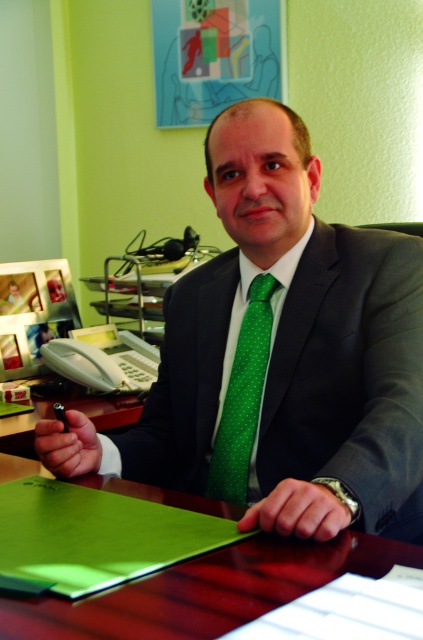
Which of these two, green dotted tie at center or green plastic pen at lower left, stands taller?

green dotted tie at center is taller.

Who is positioned more to the right, green dotted tie at center or green plastic pen at lower left?

green dotted tie at center

Identify the location of green dotted tie at center. (242, 396).

Is matte black suit at center taller than wooden table at center?

Indeed, matte black suit at center has a greater height compared to wooden table at center.

Who is positioned more to the left, matte black suit at center or wooden table at center?

From the viewer's perspective, wooden table at center appears more on the left side.

Between point (321, 490) and point (129, 616), which one is positioned in front?

Point (129, 616) is in front.

Locate an element on the screen. The height and width of the screenshot is (640, 423). matte black suit at center is located at coordinates (280, 356).

Where is `matte black suit at center`? matte black suit at center is located at coordinates (280, 356).

What do you see at coordinates (280, 356) in the screenshot? I see `matte black suit at center` at bounding box center [280, 356].

Is point (353, 440) closer to viewer compared to point (21, 413)?

Yes, it is in front of point (21, 413).

Identify the location of matte black suit at center. The width and height of the screenshot is (423, 640). (280, 356).